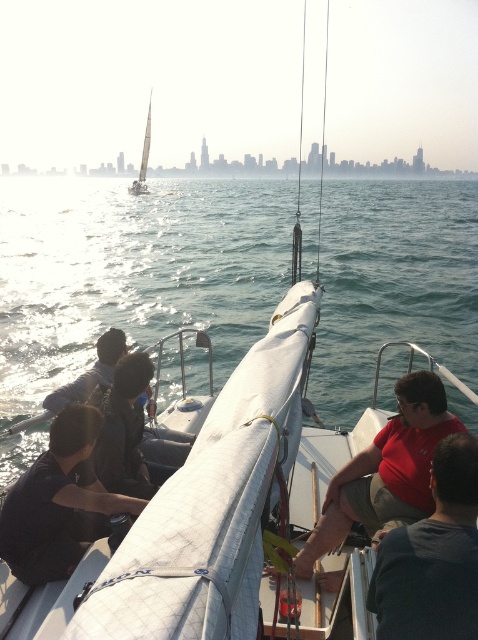
Does dark brown leather jacket at center have a larger size compared to white sailboat at upper left?

Actually, dark brown leather jacket at center might be smaller than white sailboat at upper left.

Is point (107, 474) more distant than point (141, 166)?

That is False.

Where is `dark brown leather jacket at center`? The width and height of the screenshot is (478, 640). dark brown leather jacket at center is located at coordinates (131, 435).

Does red matte shirt at center have a smaller size compared to white sailboat at upper left?

Yes, red matte shirt at center is smaller than white sailboat at upper left.

At what (x,y) coordinates should I click in order to perform the action: click on red matte shirt at center. Please return your answer as a coordinate pair (x, y). This screenshot has height=640, width=478. Looking at the image, I should click on click(386, 472).

The width and height of the screenshot is (478, 640). I want to click on red cotton shirt at center, so click(434, 556).

Does red cotton shirt at center appear over dark brown leather jacket at lower left?

No.

Which is behind, point (406, 525) or point (98, 376)?

Point (98, 376)

Locate an element on the screen. This screenshot has width=478, height=640. red cotton shirt at center is located at coordinates (434, 556).